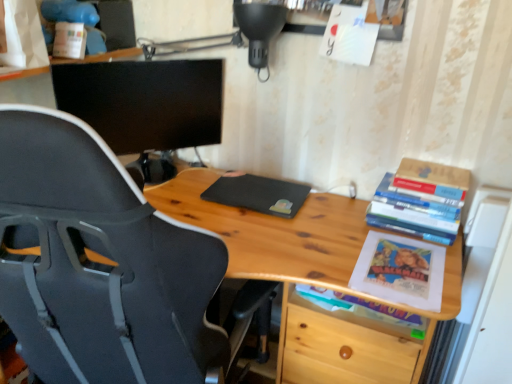
Question: Is hardcover book at upper right, which is the 3th book in bottom-to-top order, closer to the viewer compared to black matte laptop at center?

Choices:
 (A) no
 (B) yes

Answer: (B)

Question: Is black matte laptop at center completely or partially inside hardcover book at upper right, which is the 3th book in bottom-to-top order?

Choices:
 (A) yes
 (B) no

Answer: (B)

Question: From a real-world perspective, is hardcover book at upper right, which is the 3th book in bottom-to-top order, located beneath black matte laptop at center?

Choices:
 (A) no
 (B) yes

Answer: (A)

Question: Is hardcover book at upper right, acting as the 1th book starting from the top, far from black matte laptop at center?

Choices:
 (A) no
 (B) yes

Answer: (A)

Question: Is hardcover book at upper right, which is the 3th book in bottom-to-top order, beside black matte laptop at center?

Choices:
 (A) yes
 (B) no

Answer: (B)

Question: Is black matte laptop at center at the back of hardcover book at upper right, which is the 3th book in bottom-to-top order?

Choices:
 (A) yes
 (B) no

Answer: (B)

Question: Considering the relative sizes of black plastic chair at left and black matte monitor at upper left in the image provided, is black plastic chair at left taller than black matte monitor at upper left?

Choices:
 (A) no
 (B) yes

Answer: (B)

Question: Considering the relative sizes of black plastic chair at left and black matte monitor at upper left in the image provided, is black plastic chair at left bigger than black matte monitor at upper left?

Choices:
 (A) no
 (B) yes

Answer: (B)

Question: Can you confirm if black plastic chair at left is smaller than black matte monitor at upper left?

Choices:
 (A) yes
 (B) no

Answer: (B)

Question: Considering the relative positions of black plastic chair at left and black matte monitor at upper left in the image provided, is black plastic chair at left in front of black matte monitor at upper left?

Choices:
 (A) no
 (B) yes

Answer: (B)

Question: From the image's perspective, does black plastic chair at left appear lower than black matte monitor at upper left?

Choices:
 (A) no
 (B) yes

Answer: (B)

Question: Would you say black plastic chair at left contains black matte monitor at upper left?

Choices:
 (A) no
 (B) yes

Answer: (A)

Question: Considering the relative sizes of black matte monitor at upper left and wooden table at right in the image provided, is black matte monitor at upper left wider than wooden table at right?

Choices:
 (A) yes
 (B) no

Answer: (B)